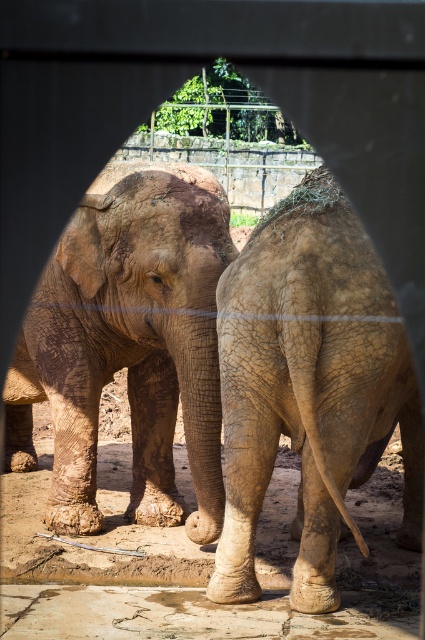
You are a zookeeper observing the elephants in their enclosure. You notice the muddy textured elephant at center and the brown textured skin at center. Which of these two elephants is smaller in size?

The muddy textured elephant at center is smaller in size compared to the brown textured skin at center.

From the picture: You are a zookeeper observing the elephants in their enclosure. You notice the muddy textured elephant at center and the brown textured skin at center. Which one is positioned more to the right side?

The brown textured skin at center is positioned more to the right side because the muddy textured elephant at center is to the left of it.

You are a zookeeper standing at the entrance of the enclosure. You need to locate the muddy textured elephant at center. According to the coordinates provided, where should you look to find it?

The muddy textured elephant at center is located at coordinates point (x=127, y=344), so you should look towards the center of the enclosure slightly to the right and lower middle area.